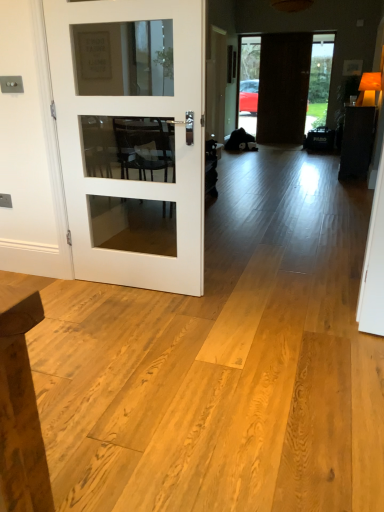
Where is `white glass door at left, which ranks as the first door in bottom-to-top order`? The height and width of the screenshot is (512, 384). white glass door at left, which ranks as the first door in bottom-to-top order is located at coordinates (134, 115).

What do you see at coordinates (134, 115) in the screenshot? The image size is (384, 512). I see `white glass door at left, which appears as the first door when viewed from the front` at bounding box center [134, 115].

This screenshot has width=384, height=512. I want to click on dark brown wooden door at center, which is the first door from back to front, so click(x=283, y=87).

This screenshot has height=512, width=384. Describe the element at coordinates (283, 87) in the screenshot. I see `dark brown wooden door at center, the first door when ordered from top to bottom` at that location.

Measure the distance between point (295, 53) and camera.

24.49 feet.

How much space does dark brown wooden door at center, arranged as the 2th door when viewed from the front, occupy vertically?

The height of dark brown wooden door at center, arranged as the 2th door when viewed from the front, is 6.68 feet.

Find the location of a particular element. white glass door at left, which appears as the second door when viewed from the right is located at coordinates (134, 115).

Based on their positions, is white glass door at left, which ranks as the first door in left-to-right order, located to the left or right of dark brown wooden door at center, the second door when ordered from left to right?

From the image, it's evident that white glass door at left, which ranks as the first door in left-to-right order, is to the left of dark brown wooden door at center, the second door when ordered from left to right.

Which object is more forward, white glass door at left, which ranks as the first door in left-to-right order, or dark brown wooden door at center, the first door when ordered from top to bottom?

Positioned in front is white glass door at left, which ranks as the first door in left-to-right order.

Which is nearer, (129, 254) or (299, 81)?

The point (129, 254) is closer.

From the image's perspective, which is below, white glass door at left, which ranks as the first door in bottom-to-top order, or dark brown wooden door at center, the second door when ordered from left to right?

From the image's view, white glass door at left, which ranks as the first door in bottom-to-top order, is below.

From a real-world perspective, is white glass door at left, which ranks as the first door in left-to-right order, below dark brown wooden door at center, the first door when ordered from top to bottom?

Yes, from a real-world perspective, white glass door at left, which ranks as the first door in left-to-right order, is beneath dark brown wooden door at center, the first door when ordered from top to bottom.

Is white glass door at left, which appears as the first door when viewed from the front, thinner than dark brown wooden door at center, which is counted as the first door, starting from the right?

No, white glass door at left, which appears as the first door when viewed from the front, is not thinner than dark brown wooden door at center, which is counted as the first door, starting from the right.

Considering the sizes of objects white glass door at left, the second door from the top, and dark brown wooden door at center, which ranks as the 2th door in bottom-to-top order, in the image provided, who is shorter, white glass door at left, the second door from the top, or dark brown wooden door at center, which ranks as the 2th door in bottom-to-top order,?

With less height is white glass door at left, the second door from the top.

From the picture: Is white glass door at left, the second door from the top, smaller than dark brown wooden door at center, the first door when ordered from top to bottom?

Incorrect, white glass door at left, the second door from the top, is not smaller in size than dark brown wooden door at center, the first door when ordered from top to bottom.

Is dark brown wooden door at center, which is counted as the first door, starting from the right, located within white glass door at left, which appears as the second door when viewed from the right?

No.

Is white glass door at left, which appears as the second door when viewed from the right, next to dark brown wooden door at center, the first door when ordered from top to bottom?

white glass door at left, which appears as the second door when viewed from the right, and dark brown wooden door at center, the first door when ordered from top to bottom, are clearly separated.

Does white glass door at left, which ranks as the first door in bottom-to-top order, turn towards dark brown wooden door at center, which is the first door from back to front?

No, white glass door at left, which ranks as the first door in bottom-to-top order, is not turned towards dark brown wooden door at center, which is the first door from back to front.

Measure the distance between white glass door at left, which appears as the 2th door when viewed from the back, and dark brown wooden door at center, the second door when ordered from left to right.

A distance of 19.62 feet exists between white glass door at left, which appears as the 2th door when viewed from the back, and dark brown wooden door at center, the second door when ordered from left to right.

Locate an element on the screen. Image resolution: width=384 pixels, height=512 pixels. door that appears above the white glass door at left, which appears as the second door when viewed from the right (from a real-world perspective) is located at coordinates (283, 87).

Does dark brown wooden door at center, arranged as the 2th door when viewed from the front, appear on the left side of white glass door at left, which appears as the second door when viewed from the right?

No.

Between dark brown wooden door at center, the second door when ordered from left to right, and white glass door at left, which ranks as the first door in bottom-to-top order, which one is positioned behind?

Positioned behind is dark brown wooden door at center, the second door when ordered from left to right.

Between point (305, 65) and point (119, 259), which one is positioned behind?

Point (305, 65)

From the image's perspective, which is above, dark brown wooden door at center, which ranks as the 2th door in bottom-to-top order, or white glass door at left, which appears as the first door when viewed from the front?

dark brown wooden door at center, which ranks as the 2th door in bottom-to-top order, appears higher in the image.

From a real-world perspective, who is located lower, dark brown wooden door at center, the first door when ordered from top to bottom, or white glass door at left, which ranks as the first door in left-to-right order?

white glass door at left, which ranks as the first door in left-to-right order.

Considering the relative sizes of dark brown wooden door at center, the second door when ordered from left to right, and white glass door at left, which appears as the second door when viewed from the right, in the image provided, is dark brown wooden door at center, the second door when ordered from left to right, thinner than white glass door at left, which appears as the second door when viewed from the right,?

Indeed, dark brown wooden door at center, the second door when ordered from left to right, has a lesser width compared to white glass door at left, which appears as the second door when viewed from the right.

Which of these two, dark brown wooden door at center, which is the first door from back to front, or white glass door at left, which ranks as the first door in left-to-right order, stands taller?

dark brown wooden door at center, which is the first door from back to front.

Which of these two, dark brown wooden door at center, the second door when ordered from left to right, or white glass door at left, the second door from the top, is smaller?

With smaller size is dark brown wooden door at center, the second door when ordered from left to right.

Is dark brown wooden door at center, the first door when ordered from top to bottom, surrounding white glass door at left, which ranks as the first door in left-to-right order?

No, white glass door at left, which ranks as the first door in left-to-right order, is located outside of dark brown wooden door at center, the first door when ordered from top to bottom.

Is dark brown wooden door at center, which is the first door from back to front, beside white glass door at left, which appears as the 2th door when viewed from the back?

No, dark brown wooden door at center, which is the first door from back to front, is not touching white glass door at left, which appears as the 2th door when viewed from the back.

Could you tell me if dark brown wooden door at center, which is the first door from back to front, is facing white glass door at left, which appears as the first door when viewed from the front?

Yes, dark brown wooden door at center, which is the first door from back to front, faces towards white glass door at left, which appears as the first door when viewed from the front.

How different are the orientations of dark brown wooden door at center, the second door when ordered from left to right, and white glass door at left, which ranks as the first door in left-to-right order, in degrees?

There is a 1.73-degree angle between the facing directions of dark brown wooden door at center, the second door when ordered from left to right, and white glass door at left, which ranks as the first door in left-to-right order.

The height and width of the screenshot is (512, 384). I want to click on door located in front of the dark brown wooden door at center, arranged as the 2th door when viewed from the front, so click(134, 115).

In the image, there is a white glass door at left, which appears as the second door when viewed from the right. At what (x,y) coordinates should I click in order to perform the action: click on door above it (from the image's perspective). Please return your answer as a coordinate pair (x, y). The width and height of the screenshot is (384, 512). Looking at the image, I should click on (283, 87).

Find the location of a particular element. The image size is (384, 512). door below the dark brown wooden door at center, arranged as the 2th door when viewed from the front (from the image's perspective) is located at coordinates (134, 115).